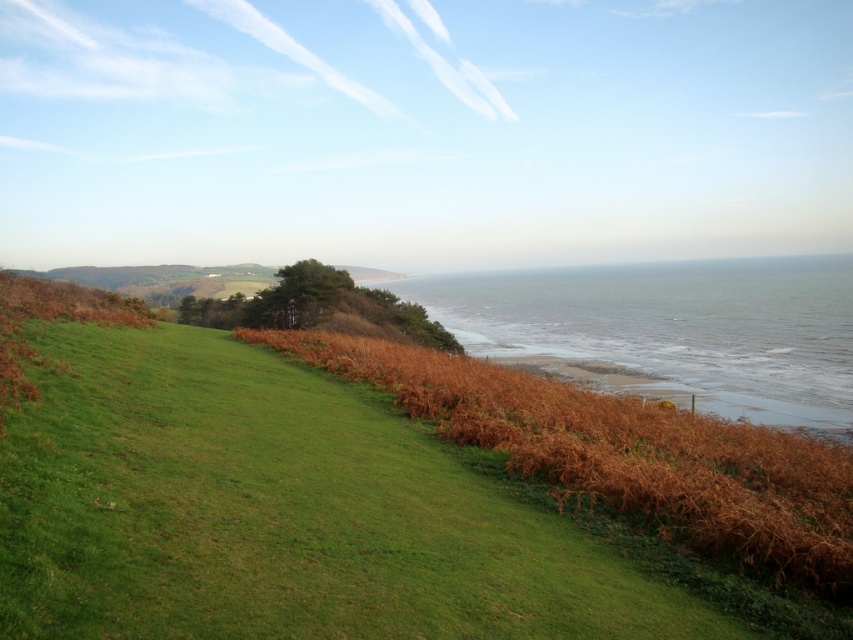
You are standing at the base of the grassy hill in the coastal landscape. You see two points marked on the image. Which point is closer to you, point [473,636] or point [724,376]?

Point [473,636] is in front of point [724,376], so it is closer to you.